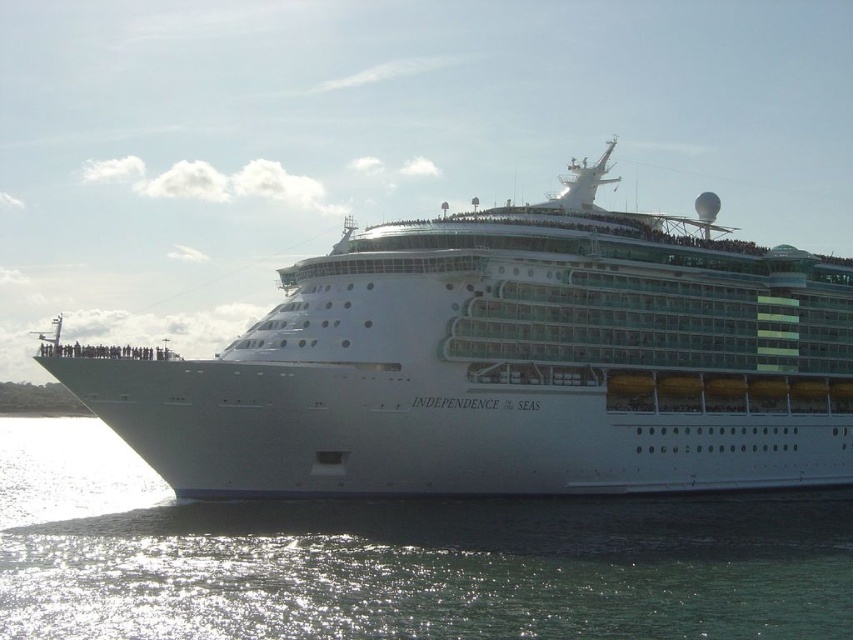
Question: Which point appears closest to the camera in this image?

Choices:
 (A) (149, 460)
 (B) (474, 573)

Answer: (B)

Question: In this image, where is white glossy cruise ship at center located relative to clear water at lower left?

Choices:
 (A) right
 (B) left

Answer: (A)

Question: Considering the relative positions of white glossy cruise ship at center and clear water at lower left in the image provided, where is white glossy cruise ship at center located with respect to clear water at lower left?

Choices:
 (A) above
 (B) below

Answer: (A)

Question: Is the position of white glossy cruise ship at center less distant than that of clear water at lower left?

Choices:
 (A) no
 (B) yes

Answer: (A)